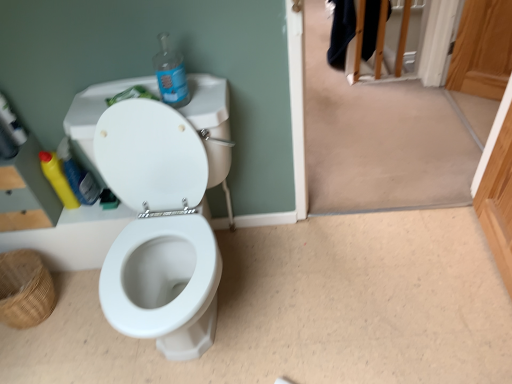
Question: Is transparent plastic bottle at upper center, which is the third bottle from left to right, outside of white glossy toilet at center?

Choices:
 (A) yes
 (B) no

Answer: (B)

Question: Is transparent plastic bottle at upper center, arranged as the 1th bottle when viewed from the right, thinner than white glossy toilet at center?

Choices:
 (A) no
 (B) yes

Answer: (B)

Question: Is transparent plastic bottle at upper center, positioned as the first bottle in front-to-back order, taller than white glossy toilet at center?

Choices:
 (A) yes
 (B) no

Answer: (B)

Question: Is white glossy toilet at center completely or partially inside transparent plastic bottle at upper center, which is the third bottle from left to right?

Choices:
 (A) no
 (B) yes

Answer: (A)

Question: Does transparent plastic bottle at upper center, arranged as the 1th bottle when viewed from the right, lie in front of white glossy toilet at center?

Choices:
 (A) yes
 (B) no

Answer: (B)

Question: Is transparent plastic bottle at upper center, arranged as the 1th bottle when viewed from the right, facing away from white glossy toilet at center?

Choices:
 (A) no
 (B) yes

Answer: (B)

Question: Can you confirm if yellow plastic bottle at left, the second bottle positioned from the front, is taller than yellow plastic bottle at left, the third bottle from the front?

Choices:
 (A) yes
 (B) no

Answer: (A)

Question: Is yellow plastic bottle at left, acting as the second bottle starting from the left, smaller than yellow plastic bottle at left, which is the third bottle in right-to-left order?

Choices:
 (A) yes
 (B) no

Answer: (B)

Question: Is yellow plastic bottle at left, which is the third bottle in right-to-left order, inside yellow plastic bottle at left, the second bottle in the back-to-front sequence?

Choices:
 (A) no
 (B) yes

Answer: (A)

Question: Does yellow plastic bottle at left, the second bottle positioned from the front, come in front of yellow plastic bottle at left, marked as the first bottle in a back-to-front arrangement?

Choices:
 (A) yes
 (B) no

Answer: (A)

Question: From a real-world perspective, is yellow plastic bottle at left, the second bottle in the back-to-front sequence, positioned over yellow plastic bottle at left, marked as the first bottle in a back-to-front arrangement, based on gravity?

Choices:
 (A) no
 (B) yes

Answer: (A)

Question: Is yellow plastic bottle at left, the second bottle positioned from the front, bigger than yellow plastic bottle at left, the third bottle from the front?

Choices:
 (A) no
 (B) yes

Answer: (B)

Question: Is transparent plastic bottle at upper center, arranged as the 3th bottle when viewed from the back, at the left side of brown woven basket at lower left?

Choices:
 (A) no
 (B) yes

Answer: (A)